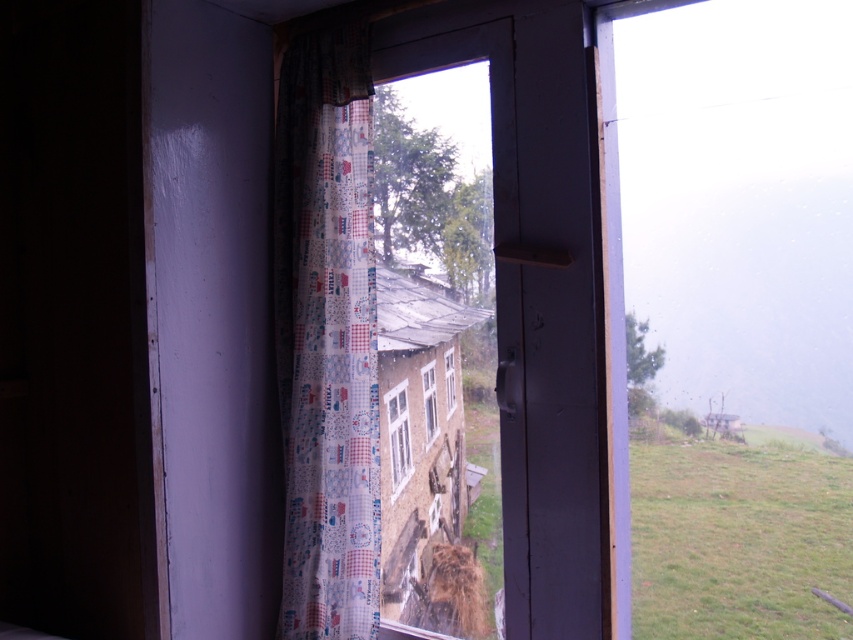
Looking at this image, who is more forward, (329, 116) or (434, 394)?

Point (329, 116) is in front.

Who is positioned more to the left, printed fabric curtain at left or transparent plastic window at center?

Positioned to the left is printed fabric curtain at left.

Does point (318, 554) come farther from viewer compared to point (430, 410)?

No, it is not.

Locate an element on the screen. Image resolution: width=853 pixels, height=640 pixels. printed fabric curtain at left is located at coordinates (326, 336).

Which is more to the left, clear glass window at center or white plastic window at center?

Positioned to the left is clear glass window at center.

Is clear glass window at center to the right of white plastic window at center from the viewer's perspective?

No, clear glass window at center is not to the right of white plastic window at center.

Is point (398, 488) positioned behind point (453, 368)?

Yes.

You are a GUI agent. You are given a task and a screenshot of the screen. Output one action in this format:
    pyautogui.click(x=<x>, y=<y>)
    Task: Click on the clear glass window at center
    The height and width of the screenshot is (640, 853).
    Given the screenshot: What is the action you would take?
    pyautogui.click(x=398, y=435)

Can you confirm if printed fabric curtain at left is smaller than clear glass window at center?

No, printed fabric curtain at left is not smaller than clear glass window at center.

Does printed fabric curtain at left appear on the right side of clear glass window at center?

Incorrect, printed fabric curtain at left is not on the right side of clear glass window at center.

Image resolution: width=853 pixels, height=640 pixels. What do you see at coordinates (326, 336) in the screenshot?
I see `printed fabric curtain at left` at bounding box center [326, 336].

The height and width of the screenshot is (640, 853). Identify the location of printed fabric curtain at left. (326, 336).